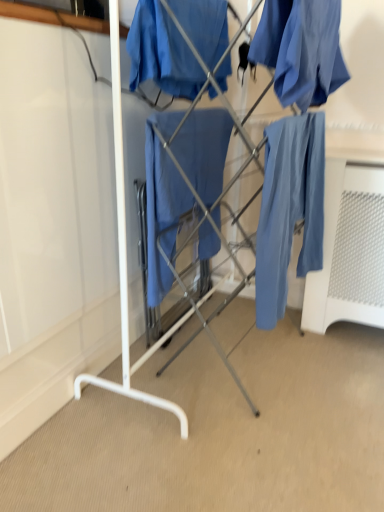
You are a GUI agent. You are given a task and a screenshot of the screen. Output one action in this format:
    pyautogui.click(x=<x>, y=<y>)
    Task: Click on the free space below matte blue fabric at center (from a real-world perspective)
    The height and width of the screenshot is (512, 384).
    Given the screenshot: What is the action you would take?
    pyautogui.click(x=230, y=355)